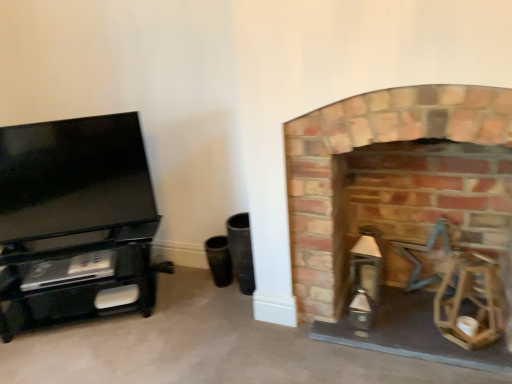
Question: In terms of size, does brick fireplace at right appear bigger or smaller than black glossy tv stand at left?

Choices:
 (A) small
 (B) big

Answer: (B)

Question: Visually, is brick fireplace at right positioned to the left or to the right of black glossy tv stand at left?

Choices:
 (A) left
 (B) right

Answer: (B)

Question: In terms of height, does brick fireplace at right look taller or shorter compared to black glossy tv stand at left?

Choices:
 (A) short
 (B) tall

Answer: (B)

Question: Relative to brick fireplace at right, is black glossy tv stand at left in front or behind?

Choices:
 (A) front
 (B) behind

Answer: (B)

Question: Considering the positions of black glossy tv stand at left and brick fireplace at right in the image, is black glossy tv stand at left taller or shorter than brick fireplace at right?

Choices:
 (A) short
 (B) tall

Answer: (A)

Question: Is black glossy tv stand at left spatially inside brick fireplace at right, or outside of it?

Choices:
 (A) outside
 (B) inside

Answer: (A)

Question: From the image's perspective, is black glossy tv stand at left above or below brick fireplace at right?

Choices:
 (A) below
 (B) above

Answer: (B)